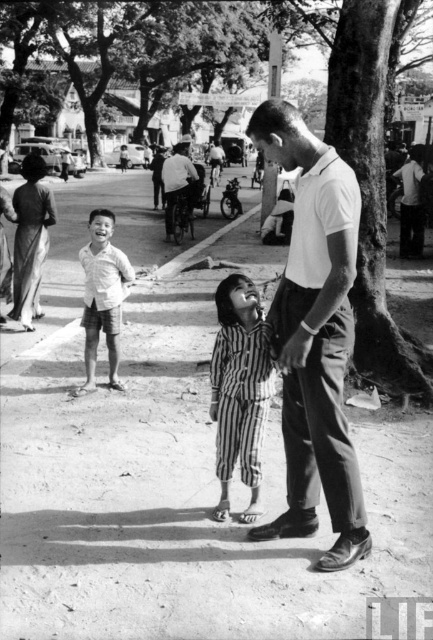
Does point (217, 502) come behind point (87, 336)?

No.

How far apart are striped fabric at center and light beige cotton shirt at center?

The distance of striped fabric at center from light beige cotton shirt at center is 7.67 feet.

This screenshot has height=640, width=433. In order to click on striped fabric at center in this screenshot , I will do `click(239, 388)`.

You are a GUI agent. You are given a task and a screenshot of the screen. Output one action in this format:
    pyautogui.click(x=<x>, y=<y>)
    Task: Click on the striped fabric at center
    Image resolution: width=433 pixels, height=640 pixels.
    Given the screenshot: What is the action you would take?
    pyautogui.click(x=239, y=388)

Is white smooth shirt at center thinner than white cotton shirt at center?

Indeed, white smooth shirt at center has a lesser width compared to white cotton shirt at center.

Is white smooth shirt at center above white cotton shirt at center?

Incorrect, white smooth shirt at center is not positioned above white cotton shirt at center.

Which is behind, point (304, 296) or point (175, 156)?

The point (175, 156) is behind.

Locate an element on the screen. The image size is (433, 640). white smooth shirt at center is located at coordinates (314, 337).

Image resolution: width=433 pixels, height=640 pixels. What do you see at coordinates (314, 337) in the screenshot?
I see `white smooth shirt at center` at bounding box center [314, 337].

Which of these two, white smooth shirt at center or light beige cotton shirt at center, stands shorter?

Standing shorter between the two is light beige cotton shirt at center.

At what (x,y) coordinates should I click in order to perform the action: click on white smooth shirt at center. Please return your answer as a coordinate pair (x, y). The image size is (433, 640). Looking at the image, I should click on (314, 337).

The width and height of the screenshot is (433, 640). Find the location of `white smooth shirt at center`. white smooth shirt at center is located at coordinates (314, 337).